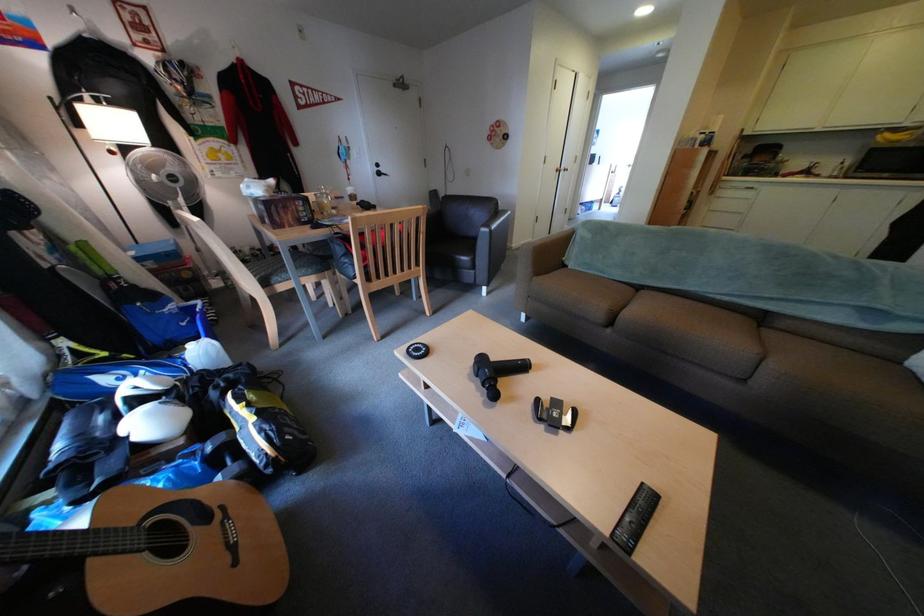
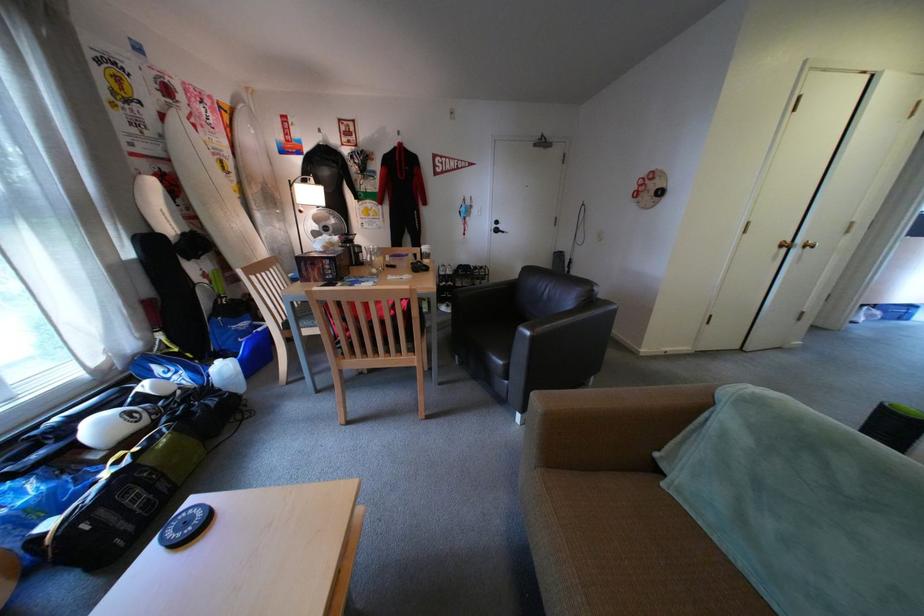
The point at (573, 169) is marked in the first image. Where is the corresponding point in the second image?

(804, 241)